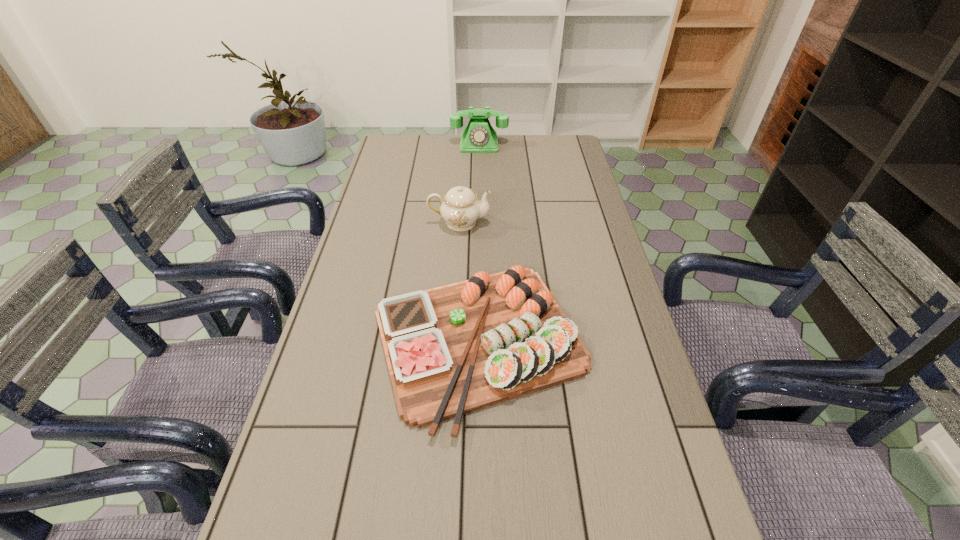
At what (x,y) coordinates should I click in order to perform the action: click on vacant space that satisfies the following two spatial constraints: 1. at the spout of the shortest object; 2. on the left side of the chinaware. Please return your answer as a coordinate pair (x, y). The height and width of the screenshot is (540, 960). Looking at the image, I should click on (453, 342).

At what (x,y) coordinates should I click in order to perform the action: click on vacant space that satisfies the following two spatial constraints: 1. on the dial of the farthest object; 2. at the spout of the second farthest object. Please return your answer as a coordinate pair (x, y). Looking at the image, I should click on (479, 222).

The width and height of the screenshot is (960, 540). I want to click on vacant space that satisfies the following two spatial constraints: 1. on the dial of the telephone; 2. at the spout of the chinaware, so click(x=479, y=222).